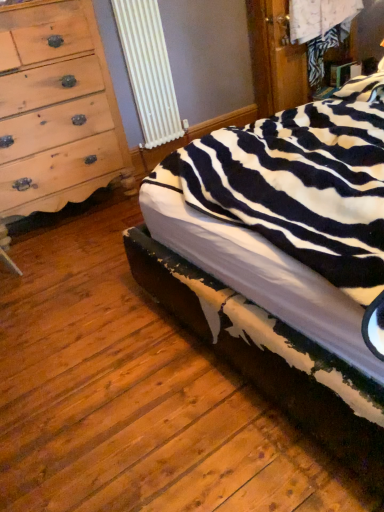
What do you see at coordinates (55, 108) in the screenshot? I see `light brown wood chest of drawers at left` at bounding box center [55, 108].

This screenshot has height=512, width=384. Identify the location of light brown wood chest of drawers at left. (55, 108).

What do you see at coordinates (282, 258) in the screenshot? I see `zebra-patterned fabric bed at center` at bounding box center [282, 258].

This screenshot has height=512, width=384. What are the coordinates of `zebra-patterned fabric bed at center` in the screenshot? It's located at (282, 258).

The height and width of the screenshot is (512, 384). Identify the location of light brown wood chest of drawers at left. (55, 108).

Considering the relative positions of light brown wood chest of drawers at left and zebra-patterned fabric bed at center in the image provided, is light brown wood chest of drawers at left to the left of zebra-patterned fabric bed at center from the viewer's perspective?

Indeed, light brown wood chest of drawers at left is positioned on the left side of zebra-patterned fabric bed at center.

Is the depth of light brown wood chest of drawers at left greater than that of zebra-patterned fabric bed at center?

Yes, it is.

Does point (62, 69) appear closer or farther from the camera than point (256, 380)?

Point (62, 69) is positioned farther from the camera compared to point (256, 380).

Consider the image. From the image's perspective, is light brown wood chest of drawers at left over zebra-patterned fabric bed at center?

Correct, light brown wood chest of drawers at left appears higher than zebra-patterned fabric bed at center in the image.

From a real-world perspective, which is physically above, light brown wood chest of drawers at left or zebra-patterned fabric bed at center?

light brown wood chest of drawers at left, from a real-world perspective.

Which of these two, light brown wood chest of drawers at left or zebra-patterned fabric bed at center, is thinner?

Thinner between the two is light brown wood chest of drawers at left.

In terms of height, does light brown wood chest of drawers at left look taller or shorter compared to zebra-patterned fabric bed at center?

Considering their sizes, light brown wood chest of drawers at left has more height than zebra-patterned fabric bed at center.

Considering the sizes of light brown wood chest of drawers at left and zebra-patterned fabric bed at center in the image, is light brown wood chest of drawers at left bigger or smaller than zebra-patterned fabric bed at center?

light brown wood chest of drawers at left is smaller than zebra-patterned fabric bed at center.

Is light brown wood chest of drawers at left spatially inside zebra-patterned fabric bed at center, or outside of it?

light brown wood chest of drawers at left cannot be found inside zebra-patterned fabric bed at center.

Is light brown wood chest of drawers at left not near zebra-patterned fabric bed at center?

Yes, light brown wood chest of drawers at left is far from zebra-patterned fabric bed at center.

Is light brown wood chest of drawers at left aimed at zebra-patterned fabric bed at center?

Yes, light brown wood chest of drawers at left is aimed at zebra-patterned fabric bed at center.

Identify the location of chest of drawers above the zebra-patterned fabric bed at center (from a real-world perspective). (55, 108).

Is zebra-patterned fabric bed at center to the left of light brown wood chest of drawers at left from the viewer's perspective?

In fact, zebra-patterned fabric bed at center is to the right of light brown wood chest of drawers at left.

Is zebra-patterned fabric bed at center closer to the viewer compared to light brown wood chest of drawers at left?

Yes, it is in front of light brown wood chest of drawers at left.

Which is closer to the camera, (190, 183) or (97, 70)?

The point (190, 183) is closer to the camera.

From the image's perspective, between zebra-patterned fabric bed at center and light brown wood chest of drawers at left, who is located below?

zebra-patterned fabric bed at center, from the image's perspective.

From a real-world perspective, is zebra-patterned fabric bed at center located beneath light brown wood chest of drawers at left?

Yes, from a real-world perspective, zebra-patterned fabric bed at center is beneath light brown wood chest of drawers at left.

Considering the sizes of zebra-patterned fabric bed at center and light brown wood chest of drawers at left in the image, is zebra-patterned fabric bed at center wider or thinner than light brown wood chest of drawers at left?

Clearly, zebra-patterned fabric bed at center has more width compared to light brown wood chest of drawers at left.

Does zebra-patterned fabric bed at center have a lesser height compared to light brown wood chest of drawers at left?

Yes.

Considering the relative sizes of zebra-patterned fabric bed at center and light brown wood chest of drawers at left in the image provided, is zebra-patterned fabric bed at center smaller than light brown wood chest of drawers at left?

Actually, zebra-patterned fabric bed at center might be larger than light brown wood chest of drawers at left.

Would you say zebra-patterned fabric bed at center is outside light brown wood chest of drawers at left?

That's correct, zebra-patterned fabric bed at center is outside of light brown wood chest of drawers at left.

Would you say zebra-patterned fabric bed at center is a long distance from light brown wood chest of drawers at left?

Yes, zebra-patterned fabric bed at center and light brown wood chest of drawers at left are quite far apart.

Is zebra-patterned fabric bed at center oriented towards light brown wood chest of drawers at left?

No, zebra-patterned fabric bed at center is not oriented towards light brown wood chest of drawers at left.

From the picture: How different are the orientations of zebra-patterned fabric bed at center and light brown wood chest of drawers at left in degrees?

The facing directions of zebra-patterned fabric bed at center and light brown wood chest of drawers at left are 91.3 degrees apart.

The width and height of the screenshot is (384, 512). Identify the location of chest of drawers that appears on the left of zebra-patterned fabric bed at center. (55, 108).

Find the location of a particular element. the chest of drawers located behind the zebra-patterned fabric bed at center is located at coordinates (55, 108).

Where is `bed that appears below the light brown wood chest of drawers at left (from the image's perspective)`? This screenshot has width=384, height=512. bed that appears below the light brown wood chest of drawers at left (from the image's perspective) is located at coordinates (282, 258).